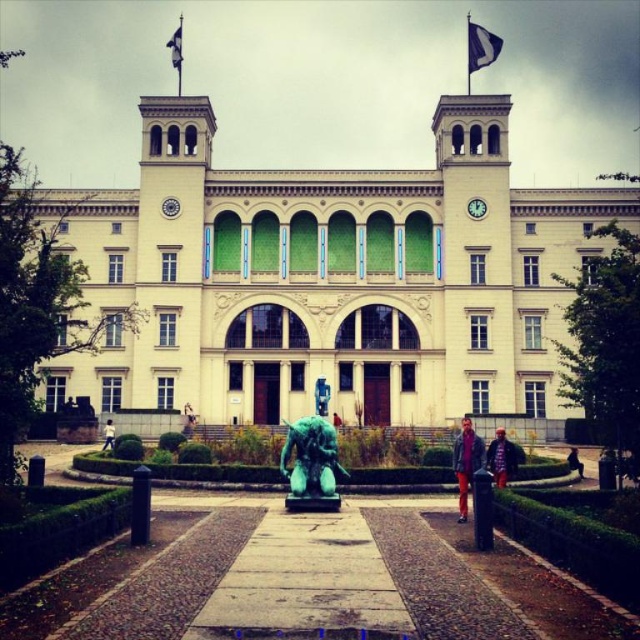
You are standing in front of the grand neoclassical building and want to reach the point marked at coordinates point (321, 432). Considering the garden in front of the building, can you estimate how far you need to walk to reach that point?

The point (321, 432) is 70.99 meters away from the camera, so you need to walk approximately 70.99 meters to reach it.